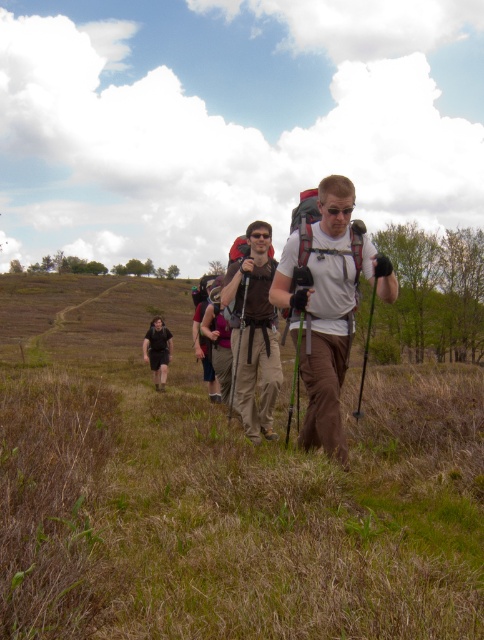
Question: Does brown dry grass at center appear over black fabric pants at center?

Choices:
 (A) no
 (B) yes

Answer: (A)

Question: Which object appears closest to the camera in this image?

Choices:
 (A) black fabric pants at center
 (B) brown dry grass at center

Answer: (B)

Question: Is white matte backpack at center positioned at the back of black fabric pants at center?

Choices:
 (A) no
 (B) yes

Answer: (A)

Question: Can you confirm if brown dry grass at center is positioned below black fabric pants at center?

Choices:
 (A) no
 (B) yes

Answer: (B)

Question: Which point appears farthest from the camera in this image?

Choices:
 (A) (168, 305)
 (B) (270, 358)

Answer: (A)

Question: Among these objects, which one is nearest to the camera?

Choices:
 (A) white matte backpack at center
 (B) black fabric pants at center
 (C) brown dry grass at center
 (D) matte brown backpack at center

Answer: (C)